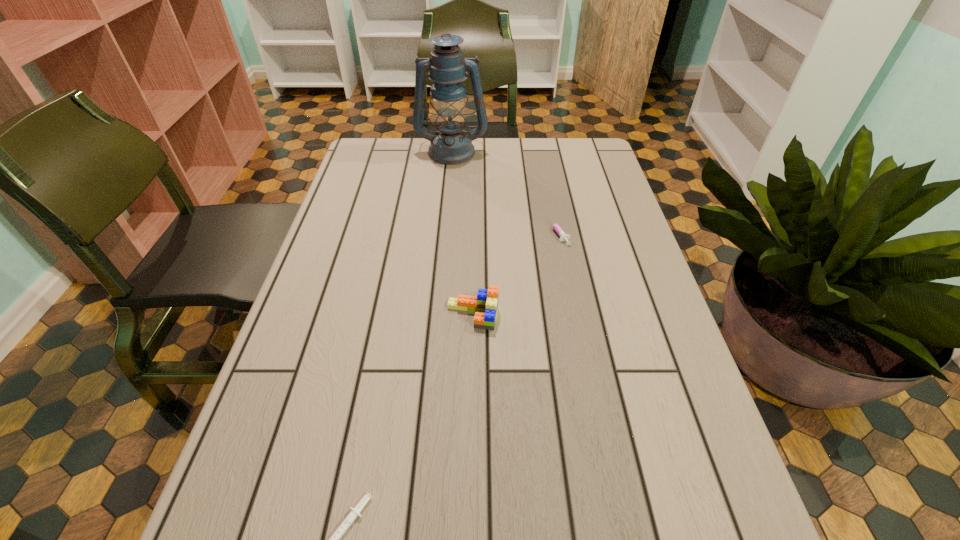
Locate an element on the screen. vacant space that satisfies the following two spatial constraints: 1. on the front-facing side of the tallest object; 2. on the right side of the farther syringe is located at coordinates (444, 232).

I want to click on free spot that satisfies the following two spatial constraints: 1. on the front-facing side of the tallest object; 2. on the right side of the Lego, so click(437, 315).

This screenshot has width=960, height=540. What are the coordinates of `free space that satisfies the following two spatial constraints: 1. on the front-facing side of the farthest object; 2. on the right side of the rightmost object` in the screenshot? It's located at (444, 232).

Where is `blank space that satisfies the following two spatial constraints: 1. on the front-facing side of the second tallest object; 2. on the right side of the tallest object`? The image size is (960, 540). blank space that satisfies the following two spatial constraints: 1. on the front-facing side of the second tallest object; 2. on the right side of the tallest object is located at coordinates (437, 315).

Identify the location of free spot that satisfies the following two spatial constraints: 1. on the front-facing side of the right syringe; 2. on the left side of the lantern. (444, 232).

In order to click on free location that satisfies the following two spatial constraints: 1. on the front-facing side of the lantern; 2. on the left side of the right syringe in this screenshot , I will do `click(444, 232)`.